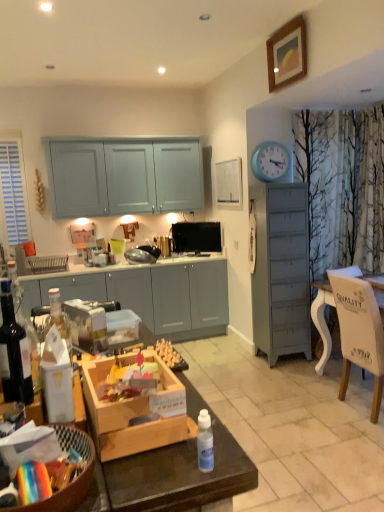
In order to face matte gray cabinets at left, should I rotate leftwards or rightwards?

You should look left and rotate roughly 10.459 degrees.

This screenshot has height=512, width=384. Find the location of `matte gray cabinets at left`. matte gray cabinets at left is located at coordinates (149, 294).

What do you see at coordinates (139, 256) in the screenshot? I see `satin black toaster at center` at bounding box center [139, 256].

The height and width of the screenshot is (512, 384). Find the location of `wooden corded phone at center`. wooden corded phone at center is located at coordinates (129, 226).

What do you see at coordinates (270, 162) in the screenshot?
I see `blue plastic clock at upper right` at bounding box center [270, 162].

Describe the element at coordinates (287, 55) in the screenshot. I see `wooden picture frame at upper center, the 2th picture frame from the bottom` at that location.

Where is `wooden picture frame at upper center, arranged as the 2th picture frame when viewed from the left`? wooden picture frame at upper center, arranged as the 2th picture frame when viewed from the left is located at coordinates (287, 55).

Locate an element on the screen. matte gray cabinets at left is located at coordinates (149, 294).

From the image's perspective, is white matte picture frame at upper center, the first picture frame positioned from the left, located above or below wooden toy box at center?

Based on their image positions, white matte picture frame at upper center, the first picture frame positioned from the left, is located above wooden toy box at center.

Would you say white matte picture frame at upper center, the first picture frame positioned from the left, is to the left or to the right of wooden toy box at center in the picture?

From the image, it's evident that white matte picture frame at upper center, the first picture frame positioned from the left, is to the right of wooden toy box at center.

Does white matte picture frame at upper center, the first picture frame positioned from the left, have a lesser height compared to wooden toy box at center?

No, white matte picture frame at upper center, the first picture frame positioned from the left, is not shorter than wooden toy box at center.

Could wooden toy box at center be considered to be inside white matte picture frame at upper center, the first picture frame positioned from the left?

No, wooden toy box at center is not surrounded by white matte picture frame at upper center, the first picture frame positioned from the left.

From the image's perspective, between translucent glass bottle at left, the first bottle positioned from the top, and green glass coffee cup at center, which one is located above?

green glass coffee cup at center, from the image's perspective.

Considering the points (15, 365) and (117, 252), which point is in front, point (15, 365) or point (117, 252)?

The point (15, 365) is closer.

How many degrees apart are the facing directions of translucent glass bottle at left, the 2th bottle in the front-to-back sequence, and green glass coffee cup at center?

The angular difference between translucent glass bottle at left, the 2th bottle in the front-to-back sequence, and green glass coffee cup at center is 180 degrees.

Looking at the image, does translucent glass bottle at left, marked as the 1th bottle in a back-to-front arrangement, seem bigger or smaller compared to green glass coffee cup at center?

Clearly, translucent glass bottle at left, marked as the 1th bottle in a back-to-front arrangement, is smaller in size than green glass coffee cup at center.

Image resolution: width=384 pixels, height=512 pixels. In order to click on coffee cup below the wooden picture frame at upper center, positioned as the 1th picture frame in right-to-left order (from a real-world perspective) in this screenshot , I will do [x=117, y=246].

From a real-world perspective, is green glass coffee cup at center over wooden picture frame at upper center, acting as the 1th picture frame starting from the front?

No, from a real-world perspective, green glass coffee cup at center is not over wooden picture frame at upper center, acting as the 1th picture frame starting from the front

Which is in front, point (121, 244) or point (277, 48)?

The point (277, 48) is more forward.

Does white wood chair at right have a larger size compared to wooden toy box at center?

Yes.

Which point is more forward, (x=349, y=281) or (x=170, y=385)?

The point (x=170, y=385) is closer.

Between white wood chair at right and wooden toy box at center, which one has less height?

wooden toy box at center is shorter.

From a real-world perspective, is white wood chair at right positioned over wooden toy box at center based on gravity?

No, from a real-world perspective, white wood chair at right is not above wooden toy box at center.

In terms of size, does white matte picture frame at upper center, which is the 1th picture frame from bottom to top, appear bigger or smaller than black glossy television at upper center?

In the image, white matte picture frame at upper center, which is the 1th picture frame from bottom to top, appears to be larger than black glossy television at upper center.

Is point (220, 200) closer or farther from the camera than point (199, 251)?

Point (220, 200) is closer to the camera than point (199, 251).

Is white matte picture frame at upper center, positioned as the 2th picture frame in top-to-bottom order, positioned behind black glossy television at upper center?

No, the depth of white matte picture frame at upper center, positioned as the 2th picture frame in top-to-bottom order, is less than that of black glossy television at upper center.

Are white matte picture frame at upper center, the first picture frame positioned from the back, and black glossy television at upper center beside each other?

No.

Is blue plastic clock at upper right facing towards silver metallic toaster at center?

No, blue plastic clock at upper right is not facing towards silver metallic toaster at center.

Is the surface of blue plastic clock at upper right in direct contact with silver metallic toaster at center?

No.

Is blue plastic clock at upper right wider than silver metallic toaster at center?

No, blue plastic clock at upper right is not wider than silver metallic toaster at center.

From the image's perspective, which object appears higher, blue plastic clock at upper right or silver metallic toaster at center?

blue plastic clock at upper right appears higher in the image.

Visually, is silver metallic toaster at center positioned to the left or to the right of matte gray cabinets at left?

silver metallic toaster at center is to the right of matte gray cabinets at left.

Based on the photo, is silver metallic toaster at center completely or partially outside of matte gray cabinets at left?

Yes, silver metallic toaster at center is located beyond the bounds of matte gray cabinets at left.

Does point (75, 345) come farther from viewer compared to point (225, 305)?

That is False.

Considering the positions of objects silver metallic toaster at center and matte gray cabinets at left in the image provided, who is behind, silver metallic toaster at center or matte gray cabinets at left?

Positioned behind is matte gray cabinets at left.

Locate an element on the screen. cardboard box that appears in front of the white matte picture frame at upper center, which is the 1th picture frame from bottom to top is located at coordinates (136, 413).

At what (x,y) coordinates should I click in order to perform the action: click on coffee cup behind the translucent glass bottle at left, the 2th bottle in the front-to-back sequence. Please return your answer as a coordinate pair (x, y). This screenshot has width=384, height=512. Looking at the image, I should click on (117, 246).

Estimate the real-world distances between objects in this image. Which object is further from white wood chair at right, green glass coffee cup at center or silver metallic toaster at center?

Based on the image, green glass coffee cup at center appears to be further to white wood chair at right.

Estimate the real-world distances between objects in this image. Which object is further from satin black toaster at center, wooden corded phone at center or transparent plastic bottle at center, positioned as the first bottle in bottom-to-top order?

transparent plastic bottle at center, positioned as the first bottle in bottom-to-top order, lies further to satin black toaster at center than the other object.

Estimate the real-world distances between objects in this image. Which object is closer to satin black toaster at center, black glossy television at upper center or wooden corded phone at center?

wooden corded phone at center is positioned closer to the anchor satin black toaster at center.

Considering their positions, is blue plastic clock at upper right positioned further to translucent glass bottle at left, the 2th bottle in the front-to-back sequence, than silver metallic toaster at center?

Based on the image, blue plastic clock at upper right appears to be further to translucent glass bottle at left, the 2th bottle in the front-to-back sequence.

Which object lies further to the anchor point translucent glass bottle at left, the first bottle positioned from the top, wooden corded phone at center or black glossy television at upper center?

wooden corded phone at center is further to translucent glass bottle at left, the first bottle positioned from the top.

Based on their spatial positions, is transparent plastic bottle at center, positioned as the first bottle in bottom-to-top order, or matte gray cabinets at left further from translucent glass bottle at left, marked as the 1th bottle in a back-to-front arrangement?

matte gray cabinets at left.

Estimate the real-world distances between objects in this image. Which object is further from wooden corded phone at center, wooden picture frame at upper center, the 2th picture frame from the bottom, or wooden toy box at center?

wooden toy box at center.

Which object lies nearer to the anchor point wooden toy box at center, silver metallic toaster at center or satin black toaster at center?

silver metallic toaster at center.

The height and width of the screenshot is (512, 384). Find the location of `clock between wooden picture frame at upper center, the 2th picture frame from the bottom, and black glossy television at upper center in the front-back direction`. clock between wooden picture frame at upper center, the 2th picture frame from the bottom, and black glossy television at upper center in the front-back direction is located at coordinates (270, 162).

The height and width of the screenshot is (512, 384). In order to click on clock between transparent plastic bottle at center, placed as the 1th bottle when sorted from right to left, and black glossy television at upper center from front to back in this screenshot , I will do `click(270, 162)`.

Identify the location of chair located between transparent plastic bottle at center, placed as the 1th bottle when sorted from right to left, and matte gray cabinets at left in the depth direction. (359, 333).

This screenshot has width=384, height=512. I want to click on cabinetry between translucent glass bottle at left, positioned as the 1th bottle in left-to-right order, and white matte picture frame at upper center, the first picture frame positioned from the left, along the z-axis, so click(x=149, y=294).